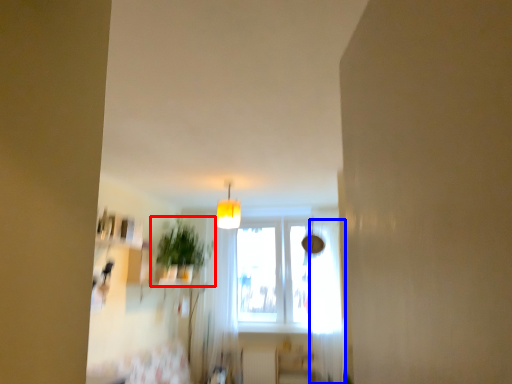
Question: Which object is closer to the camera taking this photo, houseplant (highlighted by a red box) or curtain (highlighted by a blue box)?

Choices:
 (A) houseplant
 (B) curtain

Answer: (A)